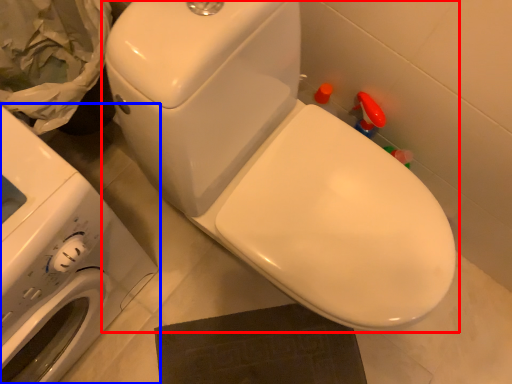
Question: Among these objects, which one is nearest to the camera, toilet (highlighted by a red box) or washing machine (highlighted by a blue box)?

Choices:
 (A) toilet
 (B) washing machine

Answer: (B)